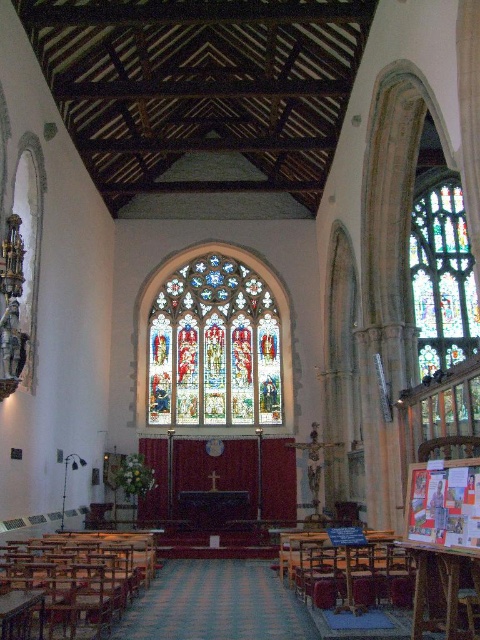
You are attending a ceremony in the church and need to sit in the wooden polished chair at lower left. Will the light from the stained glass window at center shine directly onto the chair?

The stained glass window at center is positioned over the wooden polished chair at lower left, so the light from the stained glass window at center will shine directly onto the chair.

Looking at this image, you are standing at the entrance of the church and want to take a photo of the stained glass window at center. Since you know the window is at coordinates point 0.542, 0.446, where should you position yourself to capture it in the frame?

The stained glass window at center is located at coordinates point (214, 346), so you should position yourself at the entrance facing towards the center of the church to capture it in the frame.

From the picture: You are a visitor in the church and want to sit down. You see a wooden polished chair at lower left and a wooden chair at lower center. Which chair is shorter?

The wooden polished chair at lower left is shorter than the wooden chair at lower center.